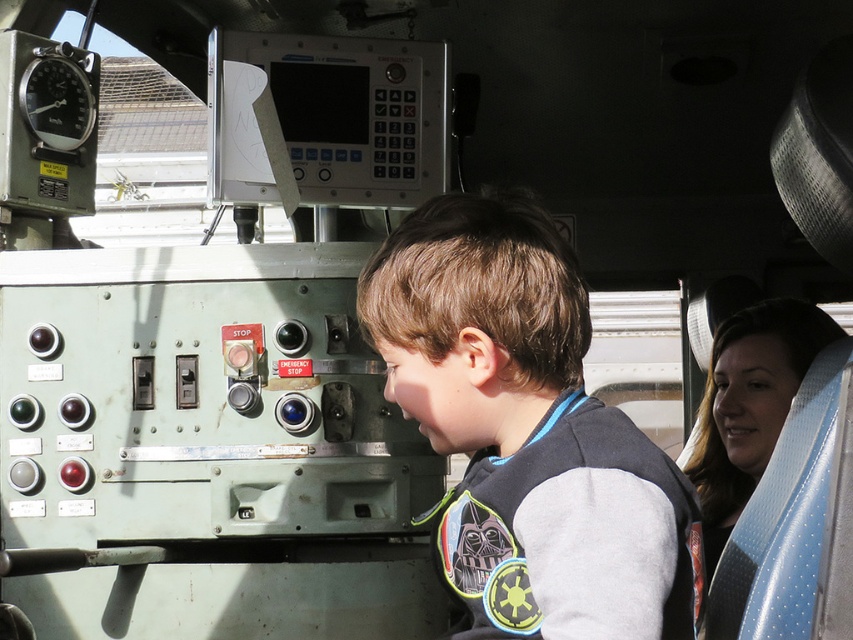
Consider the image. Is the position of gray fleece sweatshirt at center more distant than that of blue textured seat at right?

No, it is not.

Who is more forward, (486, 236) or (741, 374)?

Positioned in front is point (486, 236).

The height and width of the screenshot is (640, 853). What are the coordinates of `gray fleece sweatshirt at center` in the screenshot? It's located at (517, 416).